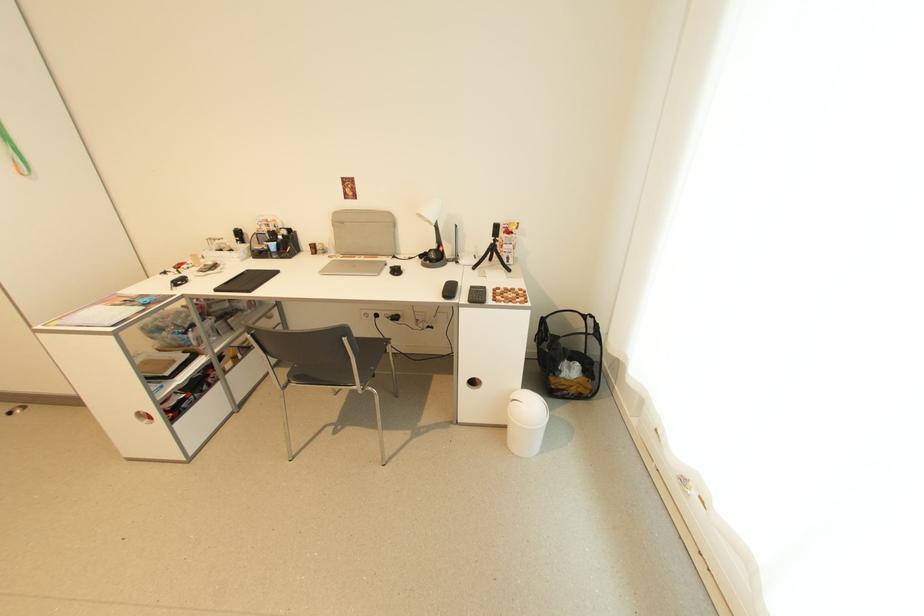
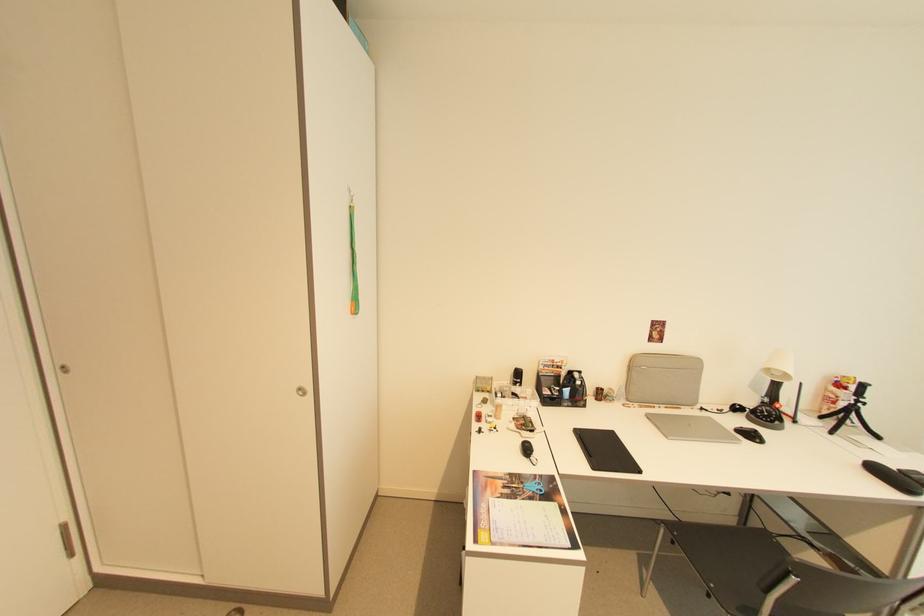
In the second image, find the point that corresponds to pixel 345 223 in the first image.

(638, 366)